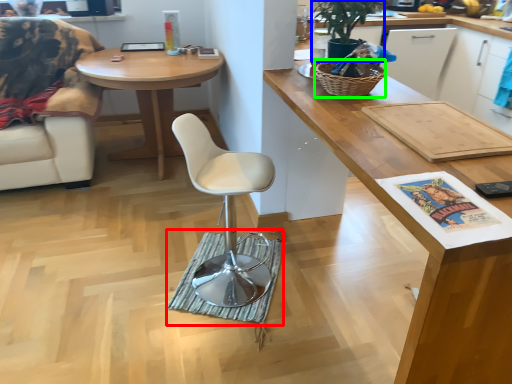
Question: Estimate the real-world distances between objects in this image. Which object is closer to mat (highlighted by a red box), houseplant (highlighted by a blue box) or picnic basket (highlighted by a green box)?

Choices:
 (A) houseplant
 (B) picnic basket

Answer: (B)